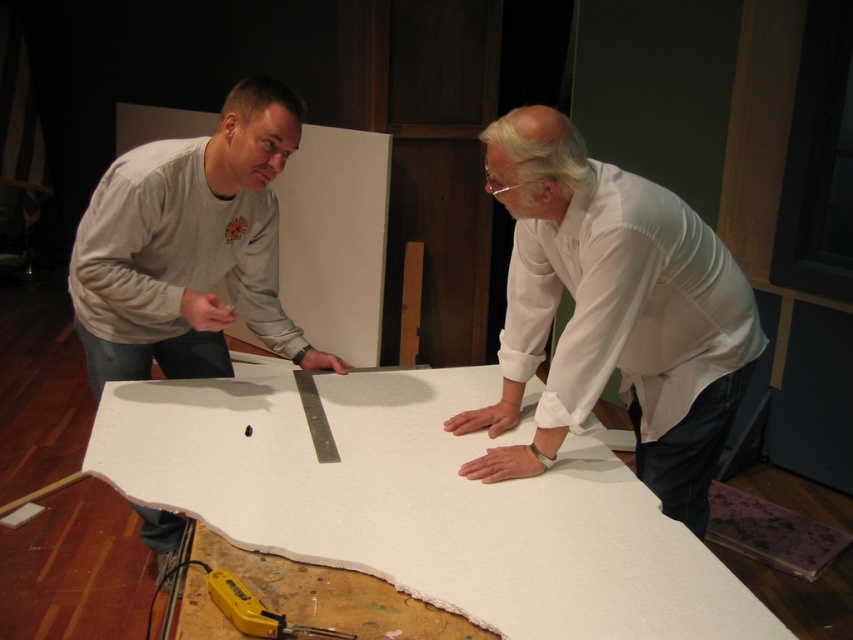
Question: Is white fabric at center thinner than white matte shirt at upper center?

Choices:
 (A) yes
 (B) no

Answer: (B)

Question: Where is white fabric at center located in relation to yellow plastic tool at lower center in the image?

Choices:
 (A) right
 (B) left

Answer: (A)

Question: Is white fabric at center to the right of gray cotton shirt at left from the viewer's perspective?

Choices:
 (A) no
 (B) yes

Answer: (B)

Question: Which point is closer to the camera?

Choices:
 (A) (209, 576)
 (B) (386, 525)
 (C) (131, 324)

Answer: (A)

Question: Considering the real-world distances, which object is closest to the yellow plastic tool at lower center?

Choices:
 (A) gray cotton shirt at left
 (B) white fabric at center
 (C) white matte shirt at upper center

Answer: (B)

Question: Based on their relative distances, which object is nearer to the gray cotton shirt at left?

Choices:
 (A) white matte shirt at upper center
 (B) white fabric at center
 (C) yellow plastic tool at lower center

Answer: (B)